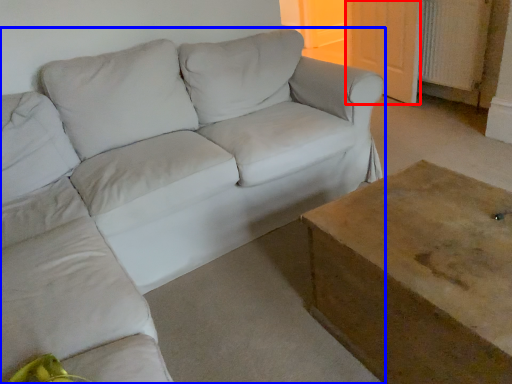
Question: Among these objects, which one is farthest to the camera, door (highlighted by a red box) or studio couch (highlighted by a blue box)?

Choices:
 (A) door
 (B) studio couch

Answer: (A)